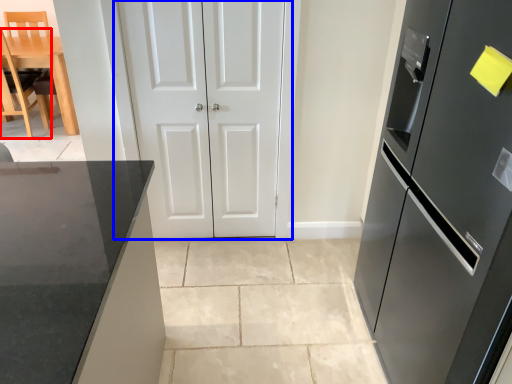
Question: Which object is closer to the camera taking this photo, chair (highlighted by a red box) or door (highlighted by a blue box)?

Choices:
 (A) chair
 (B) door

Answer: (B)